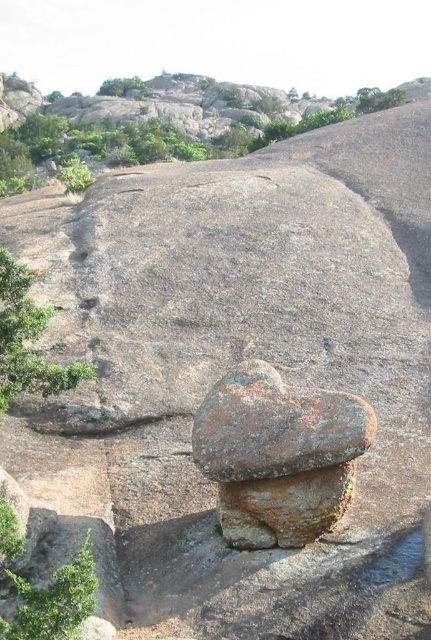
Which of these two, rusty stone mushroom at center or green leafy tree at left, stands taller?

Standing taller between the two is rusty stone mushroom at center.

Is rusty stone mushroom at center wider than green leafy tree at left?

Correct, the width of rusty stone mushroom at center exceeds that of green leafy tree at left.

Locate an element on the screen. This screenshot has height=640, width=431. rusty stone mushroom at center is located at coordinates (278, 456).

You are a GUI agent. You are given a task and a screenshot of the screen. Output one action in this format:
    pyautogui.click(x=<x>, y=<y>)
    Task: Click on the rusty stone mushroom at center
    Image resolution: width=431 pixels, height=640 pixels.
    Given the screenshot: What is the action you would take?
    pyautogui.click(x=278, y=456)

In the scene shown: Is rusty stone mushroom at center to the right of green leafy tree at lower left from the viewer's perspective?

Indeed, rusty stone mushroom at center is positioned on the right side of green leafy tree at lower left.

Which is in front, point (289, 472) or point (63, 620)?

Point (63, 620) is in front.

The width and height of the screenshot is (431, 640). Identify the location of rusty stone mushroom at center. (278, 456).

Is green leafy tree at lower left below green leafy tree at upper left?

Yes, green leafy tree at lower left is below green leafy tree at upper left.

In the scene shown: Does green leafy tree at lower left appear on the right side of green leafy tree at upper left?

Correct, you'll find green leafy tree at lower left to the right of green leafy tree at upper left.

Which is behind, point (55, 602) or point (111, 93)?

The point (111, 93) is more distant.

Image resolution: width=431 pixels, height=640 pixels. In order to click on green leafy tree at lower left in this screenshot , I will do `click(55, 600)`.